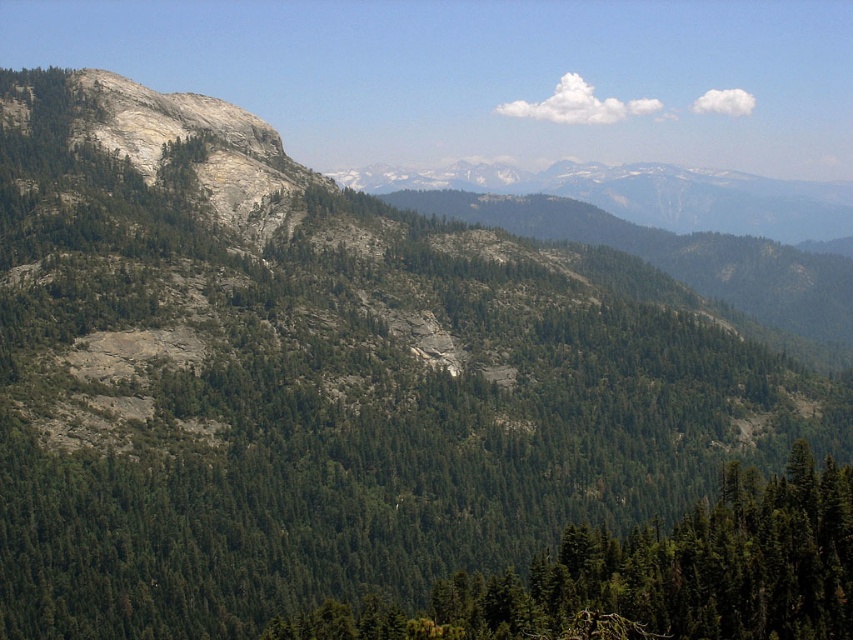
Question: Which point appears farthest from the camera in this image?

Choices:
 (A) (558, 195)
 (B) (833, 577)

Answer: (A)

Question: Does green matte tree at lower center appear on the left side of gray rocky mountain range at center?

Choices:
 (A) yes
 (B) no

Answer: (A)

Question: Which point is closer to the camera?

Choices:
 (A) gray rocky mountain range at center
 (B) green matte tree at lower center

Answer: (B)

Question: Which of the following is the farthest from the observer?

Choices:
 (A) gray rocky mountain range at center
 (B) green matte tree at lower center

Answer: (A)

Question: Does green matte tree at lower center have a lesser width compared to gray rocky mountain range at center?

Choices:
 (A) no
 (B) yes

Answer: (B)

Question: Is green matte tree at lower center to the left of gray rocky mountain range at center from the viewer's perspective?

Choices:
 (A) yes
 (B) no

Answer: (A)